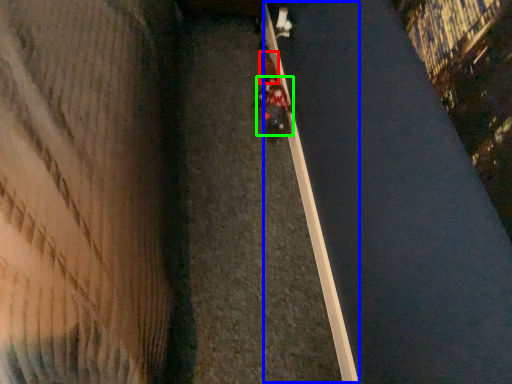
Question: Which is nearer to the pedestrian (highlighted by a red box)? curb (highlighted by a blue box) or person (highlighted by a green box).

Choices:
 (A) curb
 (B) person

Answer: (B)